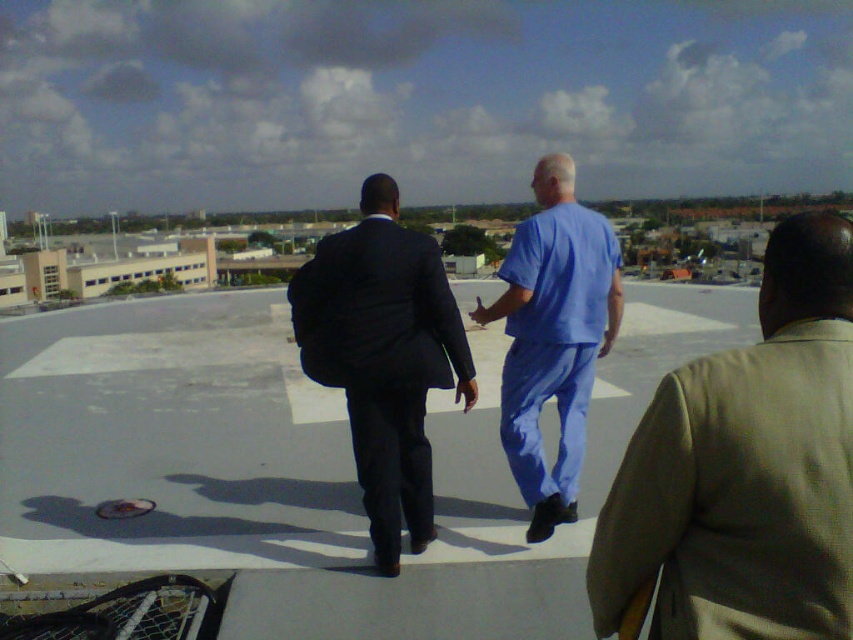
Question: Can you confirm if blue scrubs at center is thinner than matte blue scrubs at center?

Choices:
 (A) no
 (B) yes

Answer: (A)

Question: Is blue scrubs at center positioned at the back of matte blue scrubs at center?

Choices:
 (A) no
 (B) yes

Answer: (A)

Question: Which of the following is the farthest from the observer?

Choices:
 (A) (567, 202)
 (B) (780, 228)
 (C) (479, 321)

Answer: (C)

Question: Which point appears closest to the camera in this image?

Choices:
 (A) (779, 612)
 (B) (293, 285)

Answer: (A)

Question: Is the position of light brown textured suit at right less distant than that of matte blue scrubs at center?

Choices:
 (A) yes
 (B) no

Answer: (A)

Question: Considering the real-world distances, which object is farthest from the light brown textured suit at right?

Choices:
 (A) matte black suit at center
 (B) blue scrubs at center

Answer: (B)